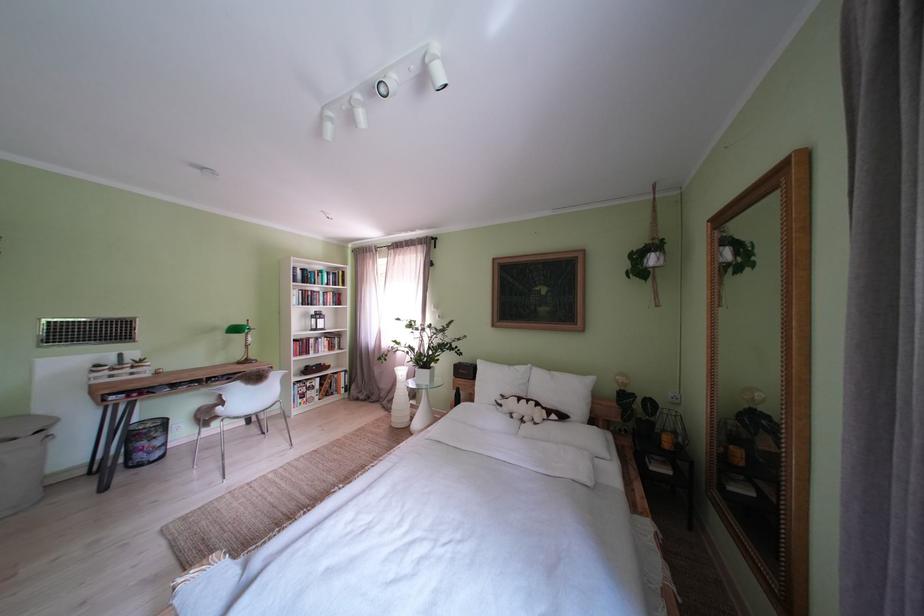
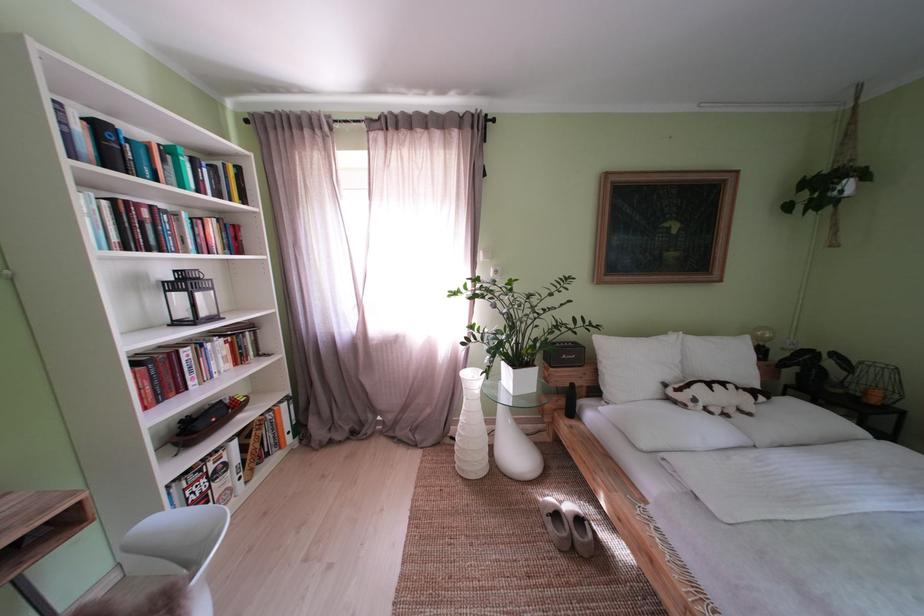
In the second image, find the point that corresponds to point 512,411 in the first image.

(706, 406)